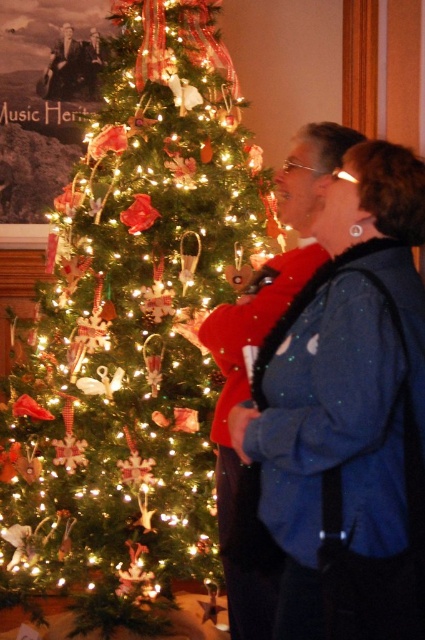
Can you confirm if green matte christmas tree at left is positioned above blue sequined jacket at center?

Yes.

Which of these two, green matte christmas tree at left or blue sequined jacket at center, stands taller?

Standing taller between the two is green matte christmas tree at left.

Which is in front, point (166, 282) or point (326, 554)?

Point (326, 554) is more forward.

Locate an element on the screen. The height and width of the screenshot is (640, 425). green matte christmas tree at left is located at coordinates (133, 326).